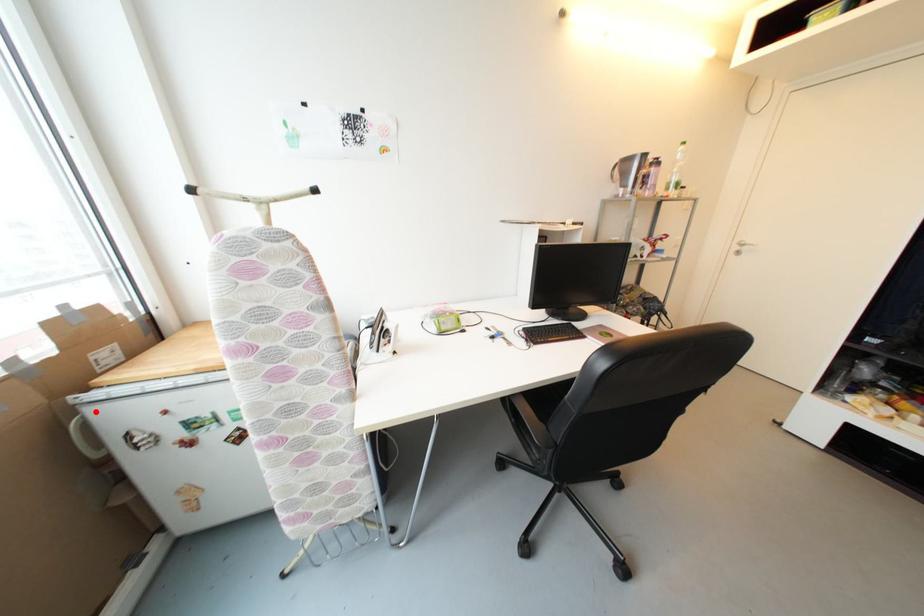
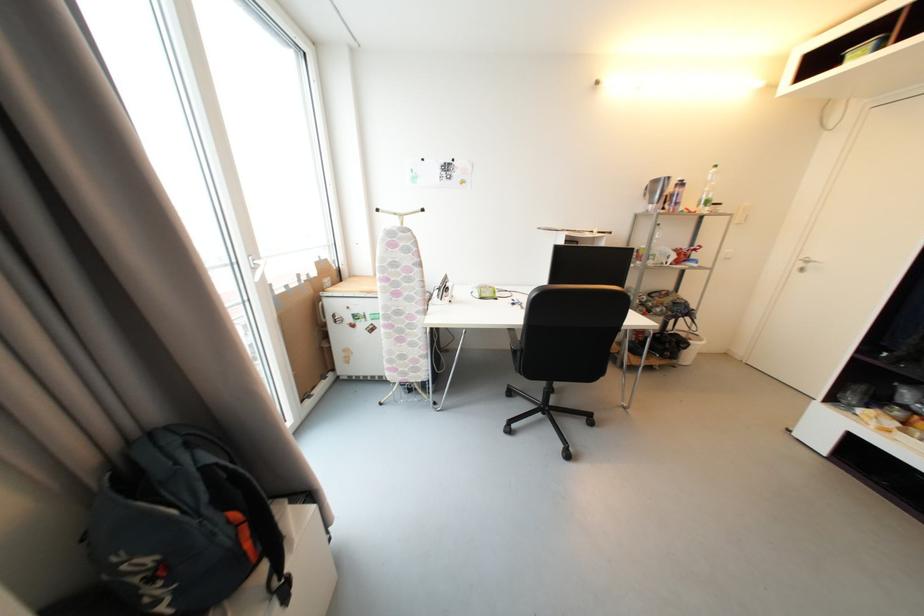
Question: I am providing you with two images of the same scene from different viewpoints. In image1, a red point is highlighted. Considering the same 3D point in image2, which of the following is correct?

Choices:
 (A) It is closer
 (B) It is farther

Answer: (A)